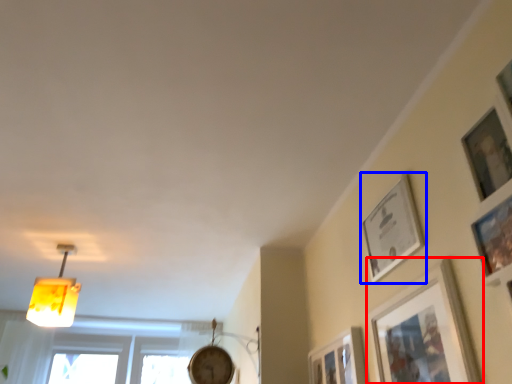
Question: Which of the following is the farthest to the observer, picture frame (highlighted by a red box) or picture frame (highlighted by a blue box)?

Choices:
 (A) picture frame
 (B) picture frame

Answer: (B)